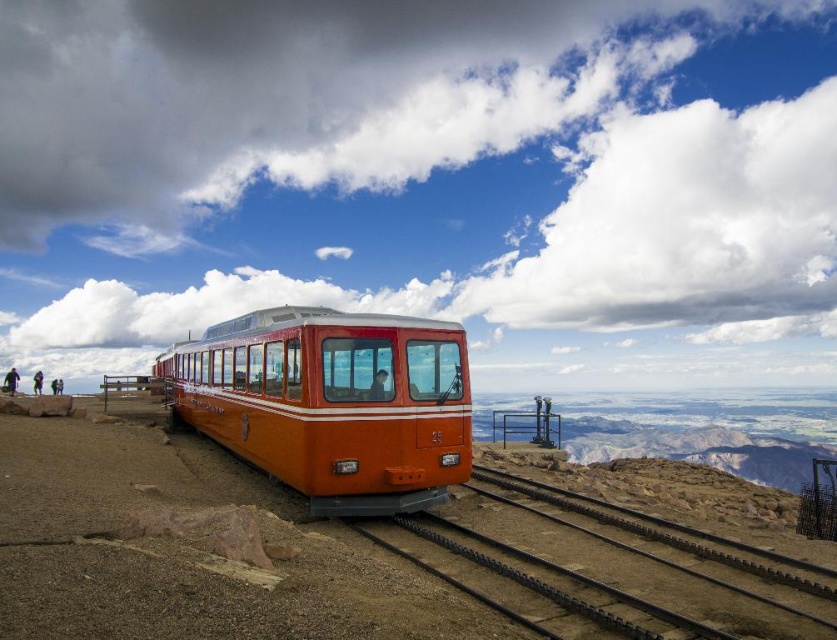
Question: Is orange matte train at center below black metal track at center?

Choices:
 (A) no
 (B) yes

Answer: (A)

Question: Can you confirm if orange matte train at center is thinner than black metal track at center?

Choices:
 (A) yes
 (B) no

Answer: (B)

Question: Which of the following is the closest to the observer?

Choices:
 (A) orange matte train at center
 (B) black metal track at center

Answer: (B)

Question: Can you confirm if orange matte train at center is positioned above black metal track at center?

Choices:
 (A) no
 (B) yes

Answer: (B)

Question: Which object is farther from the camera taking this photo?

Choices:
 (A) black metal track at center
 (B) orange matte train at center

Answer: (B)